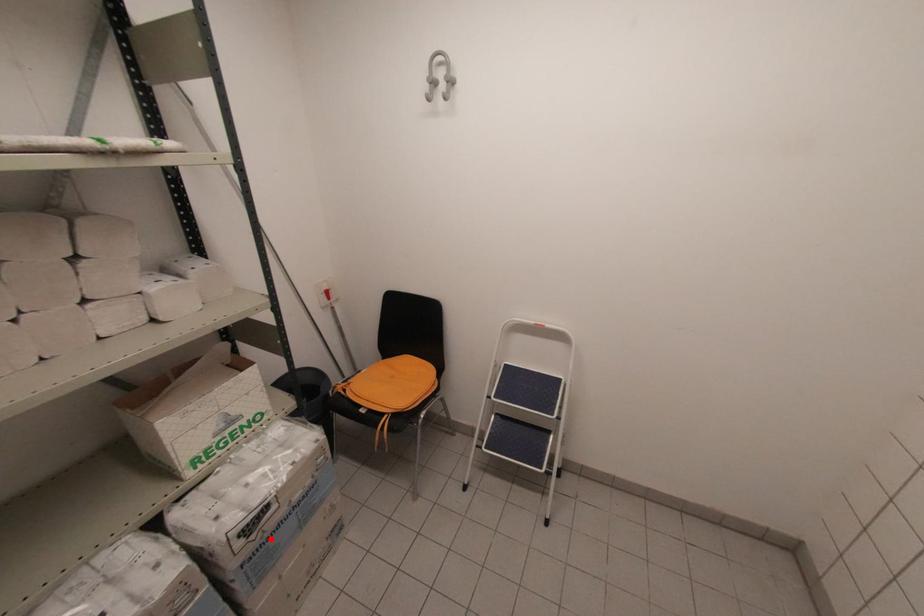
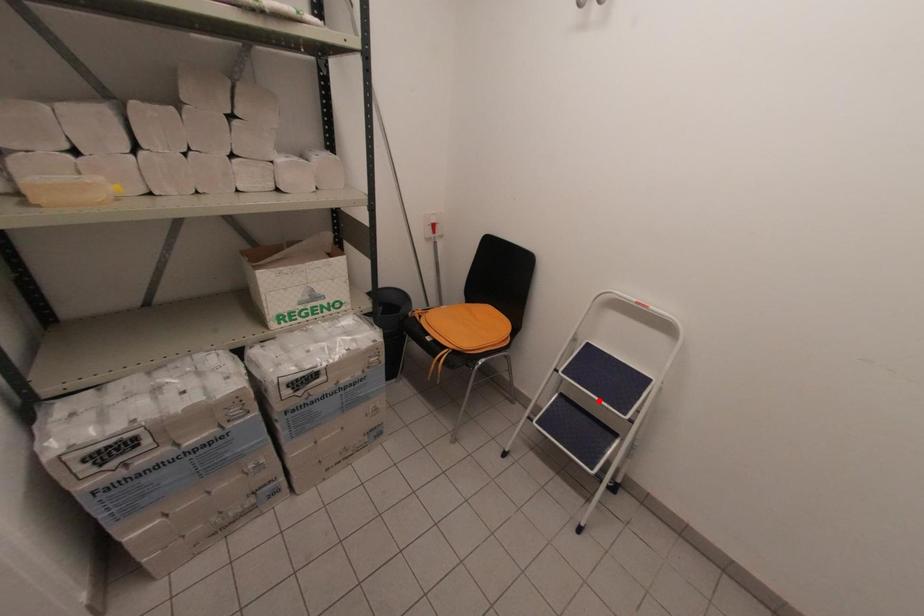
I am providing you with two images of the same scene from different viewpoints. A red point is marked on the first image and another point is marked on the second image. Is the red point in image1 aligned with the point shown in image2?

No